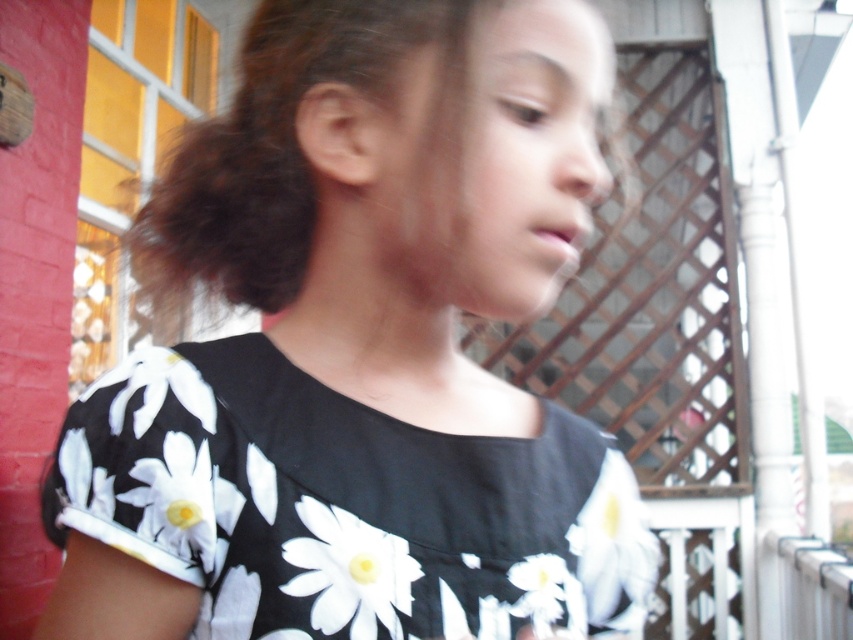
Is white matte daisy at lower left closer to the viewer compared to white matte daisy at lower right?

Yes, white matte daisy at lower left is closer to the viewer.

Is point (195, 477) less distant than point (514, 573)?

Yes, point (195, 477) is in front of point (514, 573).

Which is in front, point (175, 433) or point (537, 568)?

Point (175, 433) is more forward.

Find the location of a particular element. white matte daisy at lower left is located at coordinates (184, 500).

Between dark brown curly hair at center and white matte daisy at center, which one is positioned higher?

dark brown curly hair at center is higher up.

Between dark brown curly hair at center and white matte daisy at center, which one appears on the right side from the viewer's perspective?

Positioned to the right is white matte daisy at center.

Measure the distance between dark brown curly hair at center and camera.

The distance of dark brown curly hair at center from camera is 17.96 inches.

Where is `dark brown curly hair at center`? The height and width of the screenshot is (640, 853). dark brown curly hair at center is located at coordinates (273, 148).

Is point (421, 624) farther from camera compared to point (148, 502)?

No.

You are a GUI agent. You are given a task and a screenshot of the screen. Output one action in this format:
    pyautogui.click(x=<x>, y=<y>)
    Task: Click on the black floral fabric dress at center
    Image resolution: width=853 pixels, height=640 pixels.
    Given the screenshot: What is the action you would take?
    pyautogui.click(x=337, y=502)

Measure the distance between black floral fabric dress at center and camera.

The distance of black floral fabric dress at center from camera is 45.05 centimeters.

Where is `black floral fabric dress at center`? This screenshot has width=853, height=640. black floral fabric dress at center is located at coordinates (337, 502).